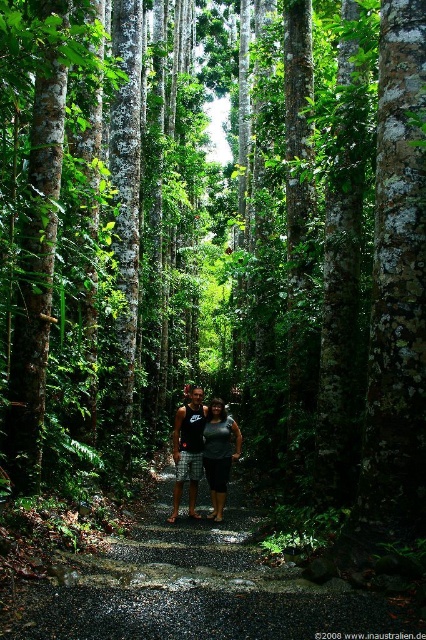
Question: Is matte black tank top at center below matte gray shorts at center?

Choices:
 (A) no
 (B) yes

Answer: (B)

Question: Which point is farther to the camera?

Choices:
 (A) matte black tank top at center
 (B) matte gray shorts at center

Answer: (B)

Question: Is matte black tank top at center bigger than matte gray shorts at center?

Choices:
 (A) yes
 (B) no

Answer: (A)

Question: Is matte black tank top at center to the left of matte gray shorts at center from the viewer's perspective?

Choices:
 (A) no
 (B) yes

Answer: (B)

Question: Which of the following is the closest to the observer?

Choices:
 (A) (221, 508)
 (B) (206, 422)

Answer: (A)